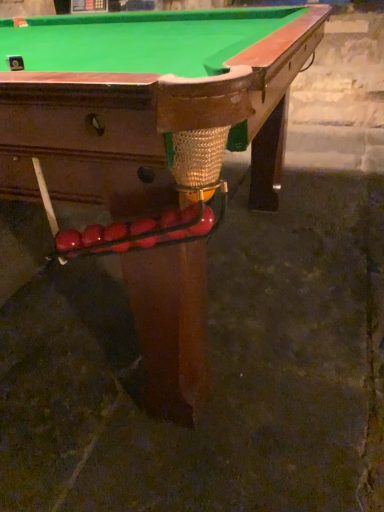
Question: From a real-world perspective, is glossy red balls at lower left over shiny brown wood billiard table at center?

Choices:
 (A) yes
 (B) no

Answer: (A)

Question: Can you confirm if glossy red balls at lower left is thinner than shiny brown wood billiard table at center?

Choices:
 (A) no
 (B) yes

Answer: (B)

Question: Is shiny brown wood billiard table at center inside glossy red balls at lower left?

Choices:
 (A) no
 (B) yes

Answer: (A)

Question: Is glossy red balls at lower left at the left side of shiny brown wood billiard table at center?

Choices:
 (A) yes
 (B) no

Answer: (B)

Question: Can you confirm if glossy red balls at lower left is wider than shiny brown wood billiard table at center?

Choices:
 (A) no
 (B) yes

Answer: (A)

Question: Considering the relative sizes of glossy red balls at lower left and shiny brown wood billiard table at center in the image provided, is glossy red balls at lower left bigger than shiny brown wood billiard table at center?

Choices:
 (A) yes
 (B) no

Answer: (B)

Question: Are shiny brown wood billiard table at center and glossy red balls at lower left located far from each other?

Choices:
 (A) no
 (B) yes

Answer: (A)

Question: From the image's perspective, is shiny brown wood billiard table at center on glossy red balls at lower left?

Choices:
 (A) yes
 (B) no

Answer: (A)

Question: Does shiny brown wood billiard table at center have a larger size compared to glossy red balls at lower left?

Choices:
 (A) no
 (B) yes

Answer: (B)

Question: Is glossy red balls at lower left completely or partially inside shiny brown wood billiard table at center?

Choices:
 (A) no
 (B) yes

Answer: (B)

Question: Are shiny brown wood billiard table at center and glossy red balls at lower left making contact?

Choices:
 (A) no
 (B) yes

Answer: (A)

Question: Considering the relative sizes of shiny brown wood billiard table at center and glossy red balls at lower left in the image provided, is shiny brown wood billiard table at center taller than glossy red balls at lower left?

Choices:
 (A) yes
 (B) no

Answer: (A)

Question: Considering the relative positions of glossy red balls at lower left and shiny brown wood billiard table at center in the image provided, is glossy red balls at lower left to the left or to the right of shiny brown wood billiard table at center?

Choices:
 (A) right
 (B) left

Answer: (A)